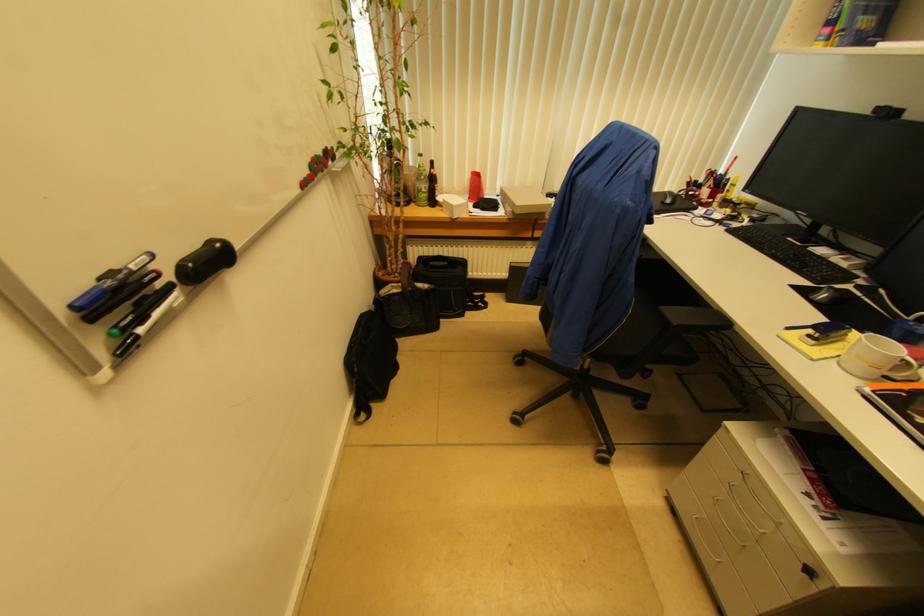
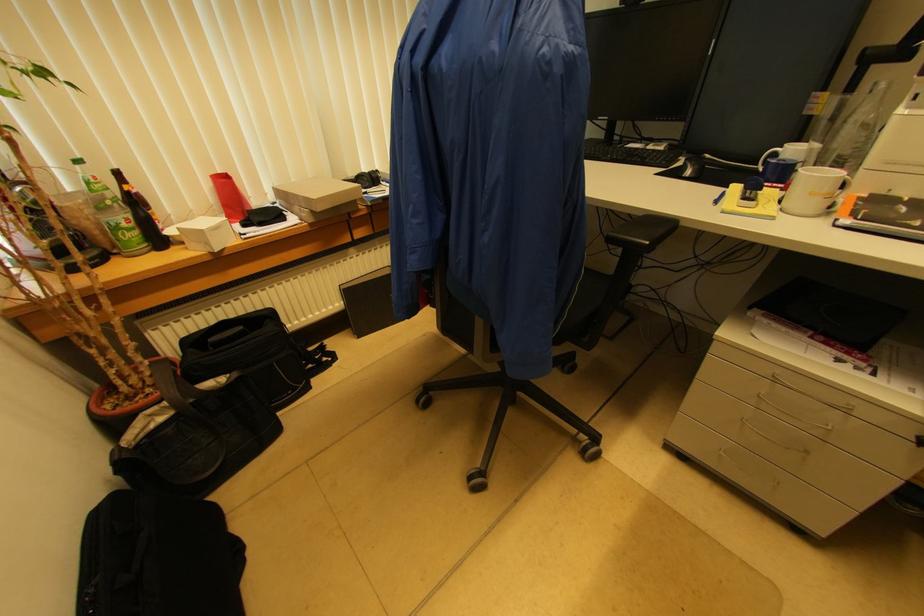
Question: The camera is either moving clockwise (left) or counter-clockwise (right) around the object. The first image is from the beginning of the video and the second image is from the end. Is the camera moving left or right when shooting the video?

Choices:
 (A) Left
 (B) Right

Answer: (A)